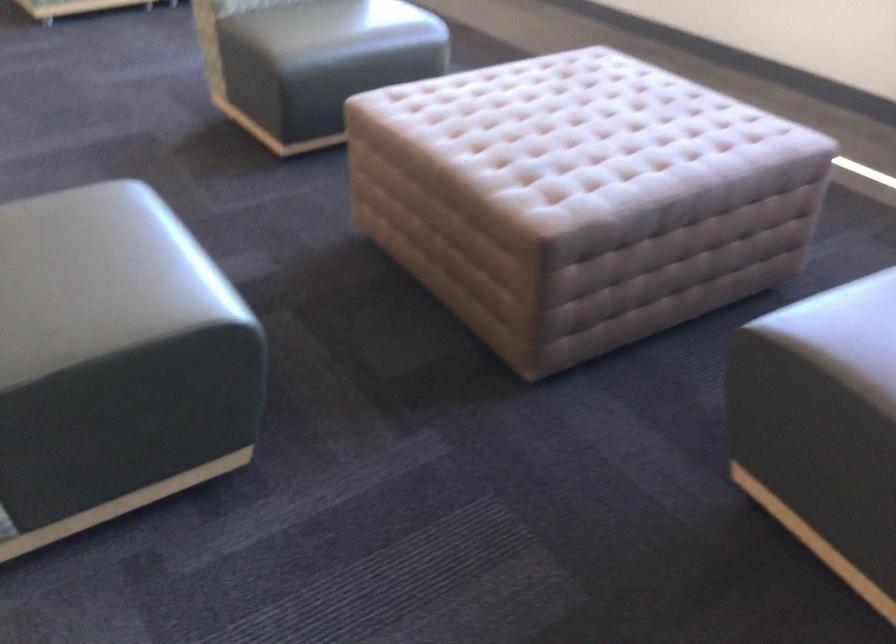
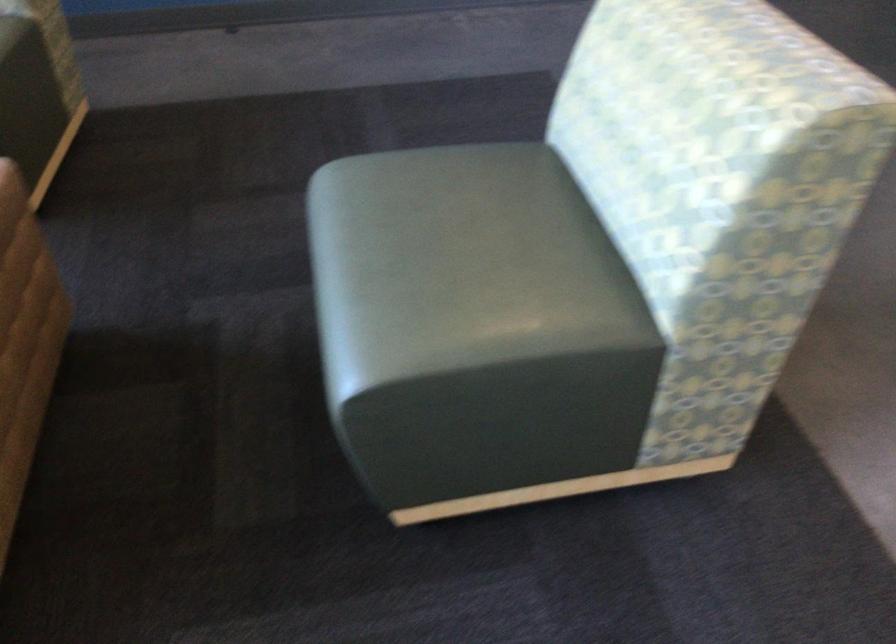
Where in the second image is the point corresponding to point (109, 232) from the first image?

(460, 265)